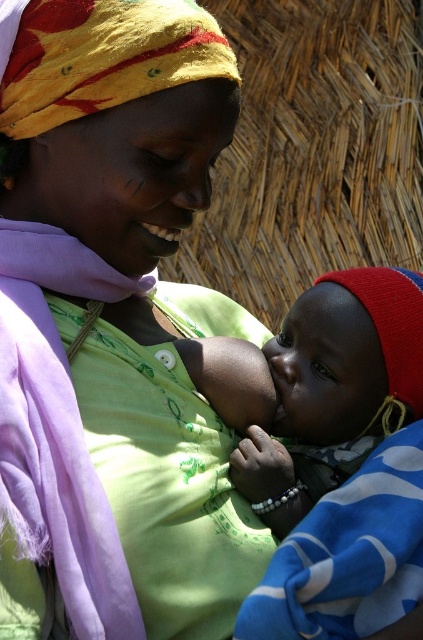
Question: Does green matte shirt at center come in front of soft blue fabric at center?

Choices:
 (A) no
 (B) yes

Answer: (B)

Question: Considering the relative positions of green matte shirt at center and soft blue fabric at center in the image provided, where is green matte shirt at center located with respect to soft blue fabric at center?

Choices:
 (A) right
 (B) left

Answer: (B)

Question: Can you confirm if green matte shirt at center is smaller than soft blue fabric at center?

Choices:
 (A) yes
 (B) no

Answer: (B)

Question: Which object appears farthest from the camera in this image?

Choices:
 (A) green matte shirt at center
 (B) soft blue fabric at center

Answer: (B)